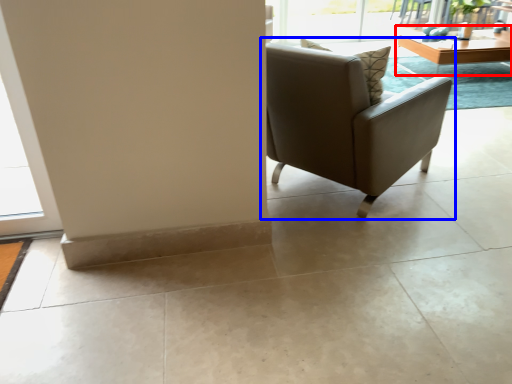
Question: Which object appears closest to the camera in this image, table (highlighted by a red box) or chair (highlighted by a blue box)?

Choices:
 (A) table
 (B) chair

Answer: (B)